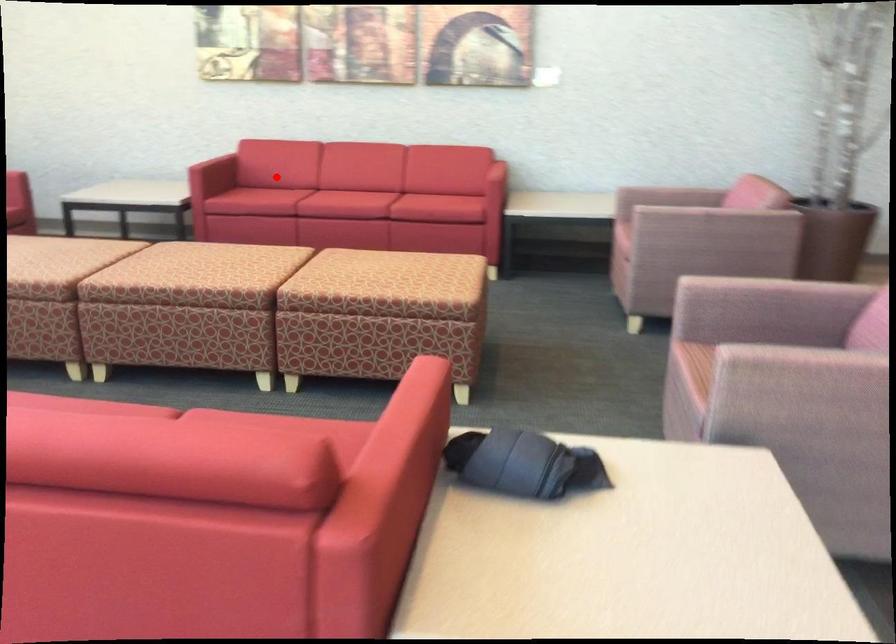
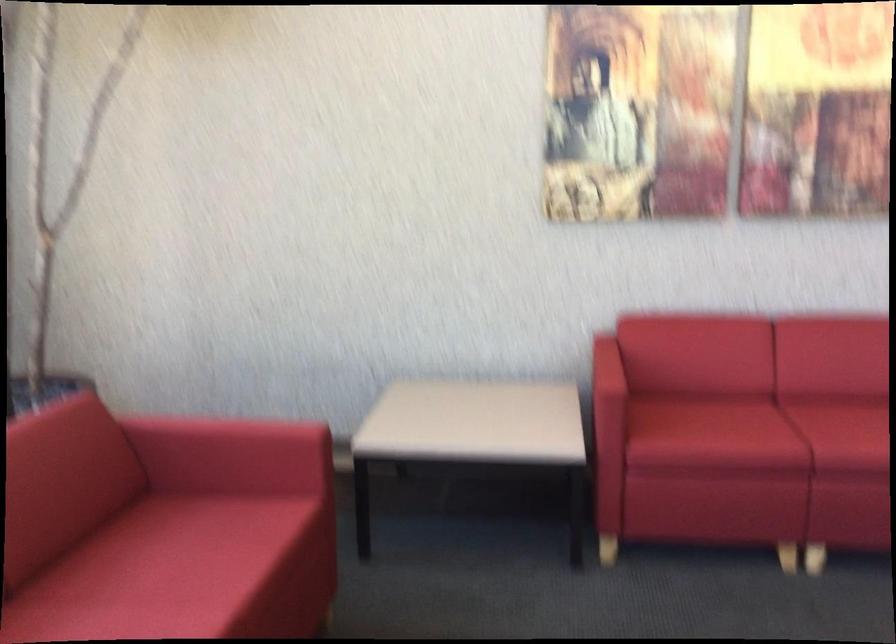
Question: I am providing you with two images of the same scene from different viewpoints. A red point is shown in image1. For the corresponding object point in image2, is it positioned nearer or farther from the camera?

Choices:
 (A) Nearer
 (B) Farther

Answer: (A)